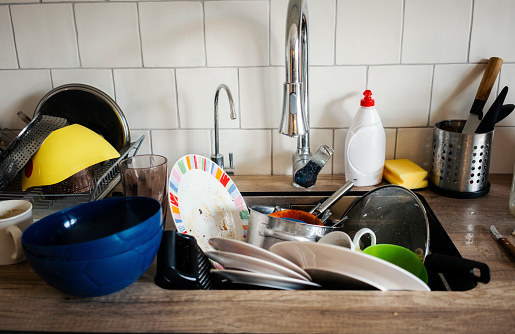
Locate an element on the screen. The image size is (515, 334). cups is located at coordinates (22, 207), (157, 173), (338, 240), (85, 178).